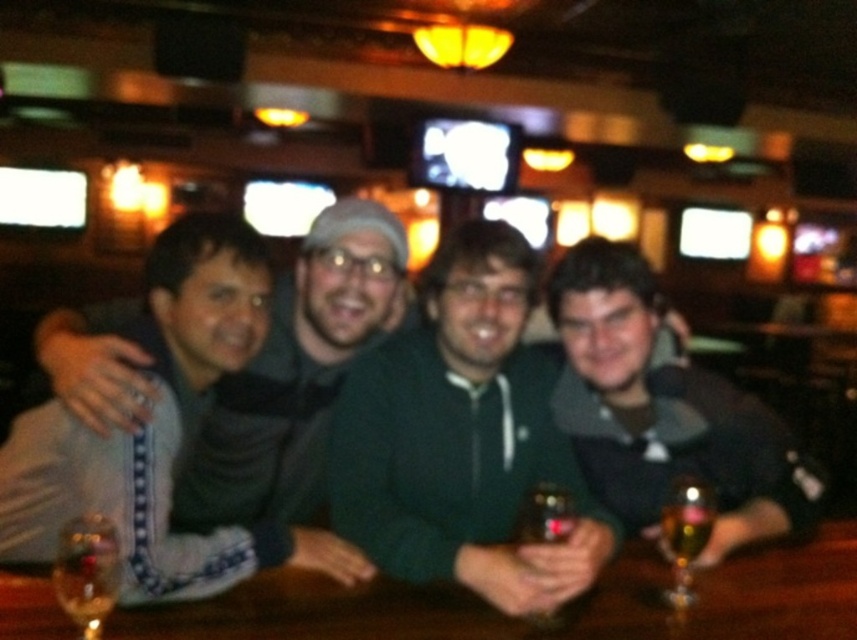
You are standing in the bar and want to hand a drink to the person wearing the green fleece jacket at center. Based on their position, which direction should you approach from?

The green fleece jacket at center is located at point (297, 372), so you should approach from the center direction to reach them.